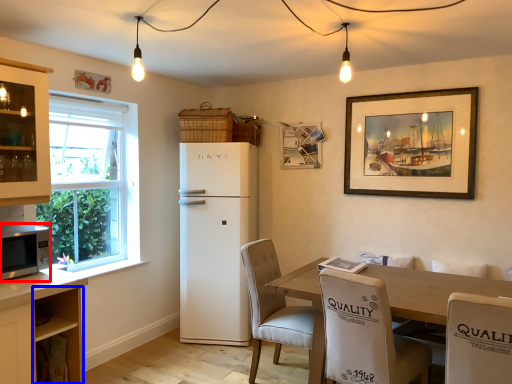
Question: Which object is further to the camera taking this photo, microwave oven (highlighted by a red box) or cabinetry (highlighted by a blue box)?

Choices:
 (A) microwave oven
 (B) cabinetry

Answer: (B)